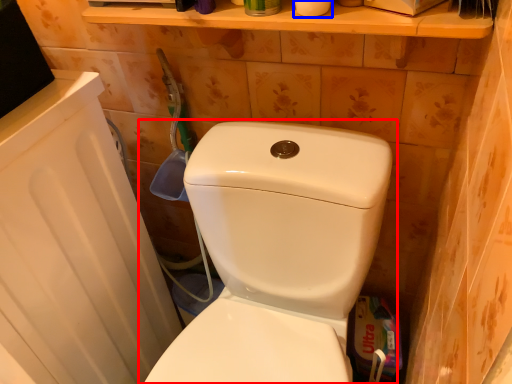
Question: Which point is closer to the camera, toilet (highlighted by a red box) or toilet paper (highlighted by a blue box)?

Choices:
 (A) toilet
 (B) toilet paper

Answer: (A)